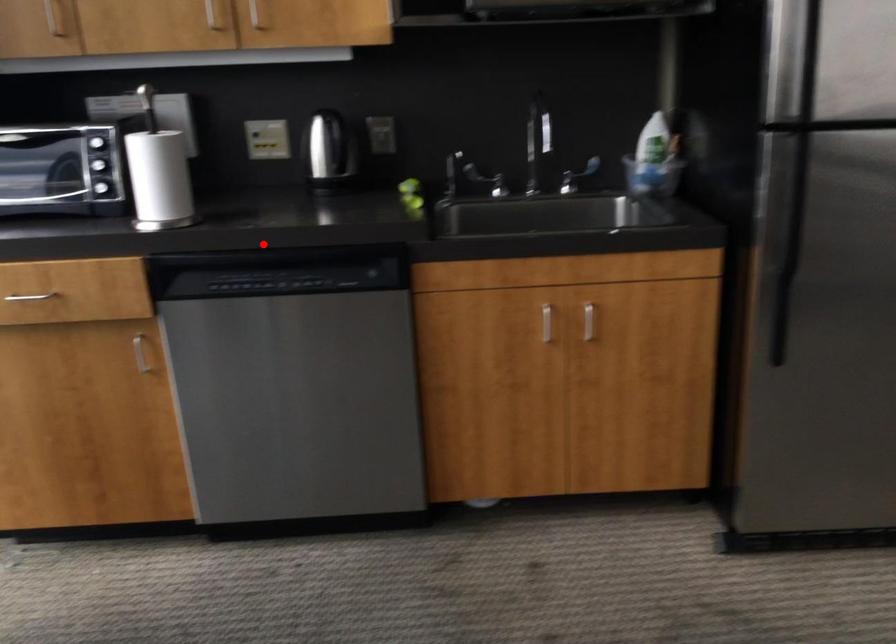
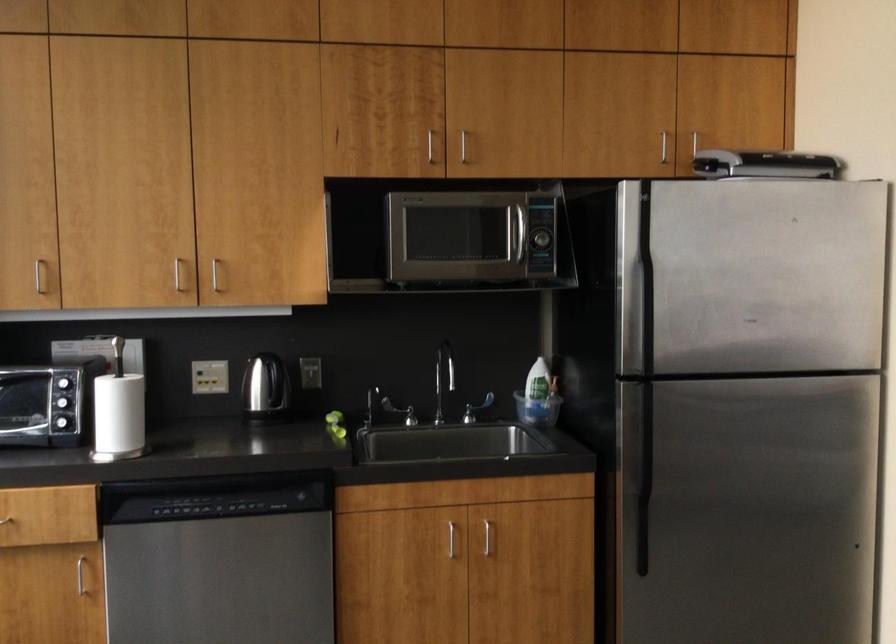
Question: I am providing you with two images of the same scene from different viewpoints. In image1, a red point is highlighted. Considering the same 3D point in image2, which of the following is correct?

Choices:
 (A) It is closer
 (B) It is farther

Answer: (B)